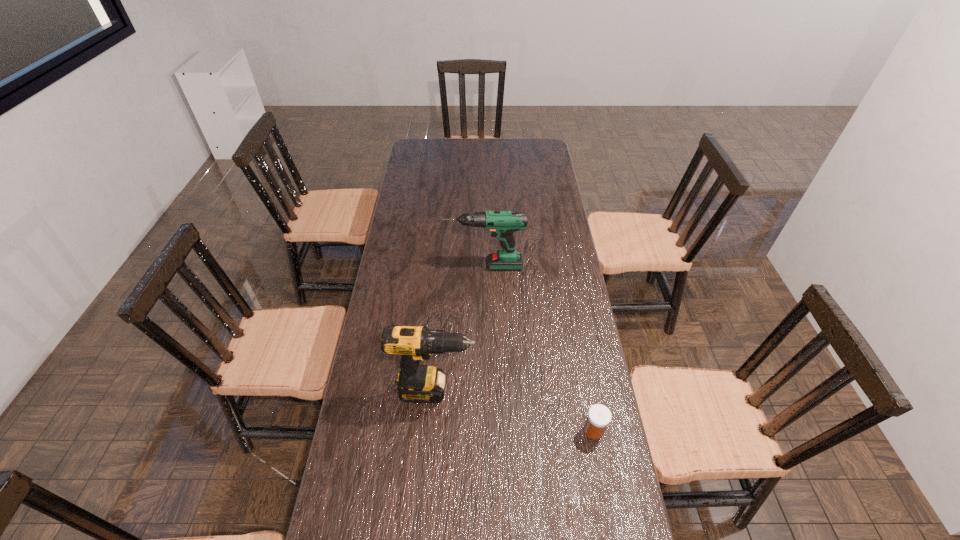
Locate an element on the screen. The image size is (960, 540). the nearer drill is located at coordinates [418, 383].

The width and height of the screenshot is (960, 540). What are the coordinates of `the farthest object` in the screenshot? It's located at (502, 224).

Where is `the rightmost object`? the rightmost object is located at coordinates (599, 416).

Find the location of a particular element. the shortest object is located at coordinates point(599,416).

You are a GUI agent. You are given a task and a screenshot of the screen. Output one action in this format:
    pyautogui.click(x=<x>, y=<y>)
    Task: Click on the free space located at the tip of the nearer drill
    The width and height of the screenshot is (960, 540).
    Given the screenshot: What is the action you would take?
    pyautogui.click(x=565, y=390)

Locate an element on the screen. free space located on the handle side of the farther drill is located at coordinates (391, 266).

Find the location of a particular element. The image size is (960, 540). free space located 0.220m on the handle side of the farther drill is located at coordinates (388, 266).

At what (x,y) coordinates should I click in order to perform the action: click on blank space located 0.180m on the handle side of the farther drill. Please return your answer as a coordinate pair (x, y). This screenshot has width=960, height=540. Looking at the image, I should click on (398, 266).

Find the location of a particular element. This screenshot has width=960, height=540. vacant point located on the back of the rightmost object is located at coordinates (577, 343).

The width and height of the screenshot is (960, 540). What are the coordinates of `object present at the left edge` in the screenshot? It's located at (418, 383).